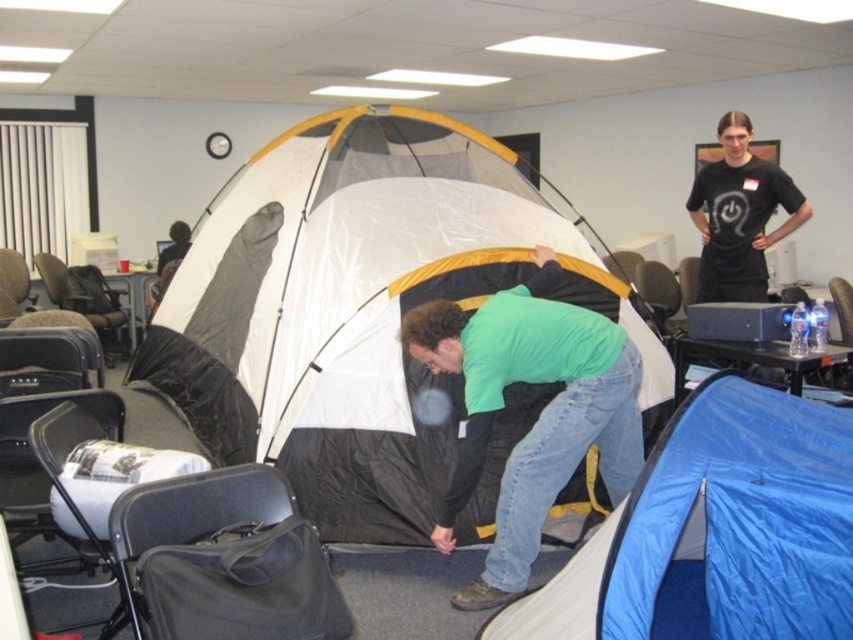
Question: Does blue tarp at lower right have a lesser width compared to green matte shirt at center?

Choices:
 (A) yes
 (B) no

Answer: (B)

Question: Estimate the real-world distances between objects in this image. Which object is farther from the black t-shirt at upper right?

Choices:
 (A) white matte tent at center
 (B) green matte shirt at center
 (C) blue tarp at lower right

Answer: (C)

Question: Can you confirm if white matte tent at center is positioned above green matte shirt at center?

Choices:
 (A) yes
 (B) no

Answer: (A)

Question: Which point appears farthest from the camera in this image?

Choices:
 (A) (514, 461)
 (B) (744, 262)
 (C) (341, 401)

Answer: (B)

Question: Which point is closer to the camera taking this photo?

Choices:
 (A) (738, 204)
 (B) (416, 339)

Answer: (B)

Question: Is white matte tent at center below green matte shirt at center?

Choices:
 (A) yes
 (B) no

Answer: (B)